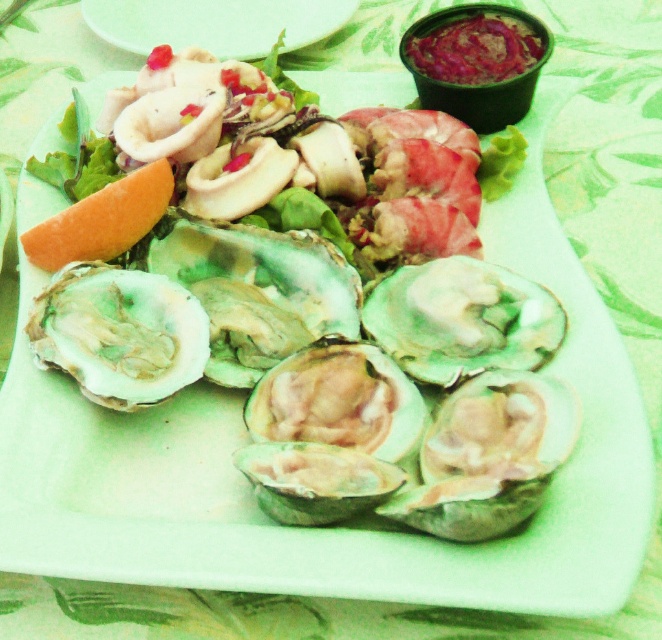
Question: Which point appears farthest from the camera in this image?

Choices:
 (A) (132, 365)
 (B) (167, 44)

Answer: (B)

Question: Does greenish shell oyster at center have a greater width compared to white glossy plate at upper center?

Choices:
 (A) no
 (B) yes

Answer: (A)

Question: Among these objects, which one is farthest from the camera?

Choices:
 (A) white glossy plate at upper center
 (B) greenish shell oyster at center

Answer: (A)

Question: Does greenish shell oyster at center have a larger size compared to white glossy plate at upper center?

Choices:
 (A) yes
 (B) no

Answer: (B)

Question: Is greenish shell oyster at center to the left of white glossy plate at upper center from the viewer's perspective?

Choices:
 (A) yes
 (B) no

Answer: (A)

Question: Which of the following is the farthest from the observer?

Choices:
 (A) white glossy plate at upper center
 (B) greenish shell oyster at center

Answer: (A)